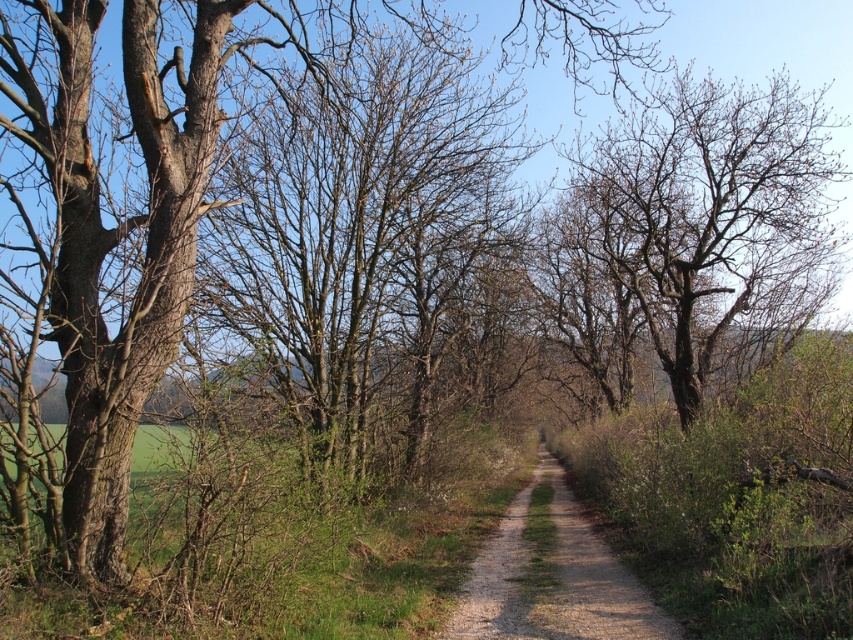
Question: Is brown bark tree at center bigger than dirt/gravel path at center?

Choices:
 (A) no
 (B) yes

Answer: (B)

Question: Does brown bark tree at center appear under dirt/gravel path at center?

Choices:
 (A) no
 (B) yes

Answer: (A)

Question: Which of the following is the closest to the observer?

Choices:
 (A) dirt/gravel path at center
 (B) bare brown tree at center

Answer: (A)

Question: Is brown bark tree at center in front of bare brown tree at center?

Choices:
 (A) no
 (B) yes

Answer: (B)

Question: Considering the real-world distances, which object is closest to the bare brown tree at center?

Choices:
 (A) dirt/gravel path at center
 (B) brown bark tree at center

Answer: (B)

Question: Among these points, which one is nearest to the camera?

Choices:
 (A) (212, 118)
 (B) (677, 202)
 (C) (537, 486)

Answer: (A)